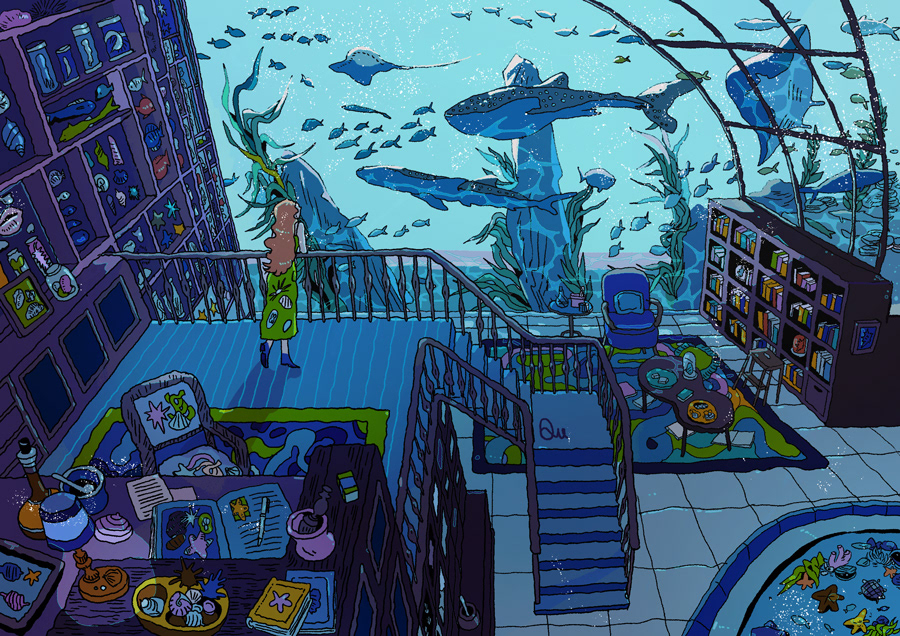
The image size is (900, 636). In order to click on bookcase in this screenshot , I will do `click(779, 296)`.